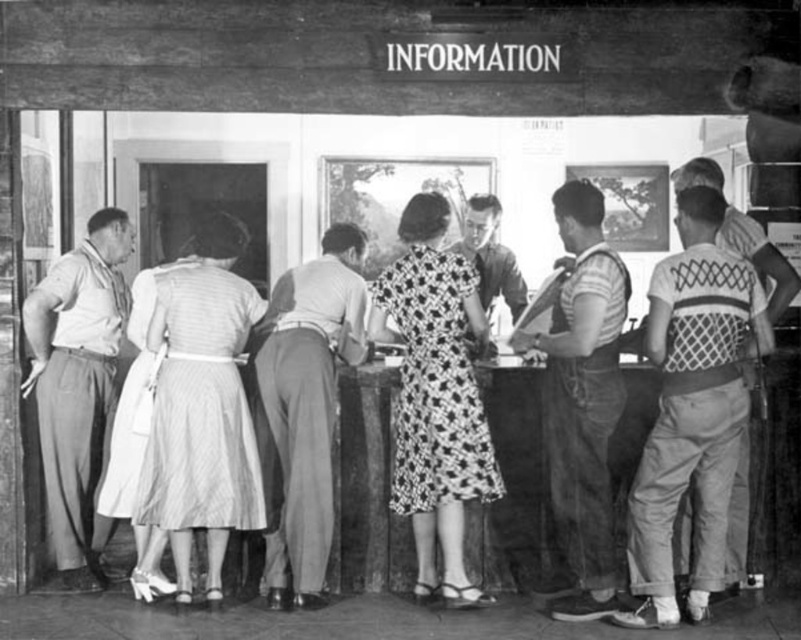
You are a visitor at the information desk and notice two people in the scene. One is wearing a knitted sweater at right and the other a printed fabric dress at center. Which person is standing closer to the right side of the desk?

The knitted sweater at right is to the right of the printed fabric dress at center, so the person wearing the knitted sweater at right is standing closer to the right side of the desk.

You are a tour guide standing at the information desk. You need to hand out maps to both the printed fabric dress at center and the smooth white shirt at left. The maps are 1 foot in length each. Can you reach both individuals without moving from your current position?

The printed fabric dress at center is 6.60 feet away from the smooth white shirt at left. Since the maps are 1 foot in length each, you can reach both individuals without moving from your current position as the distance between them is greater than the map length required.